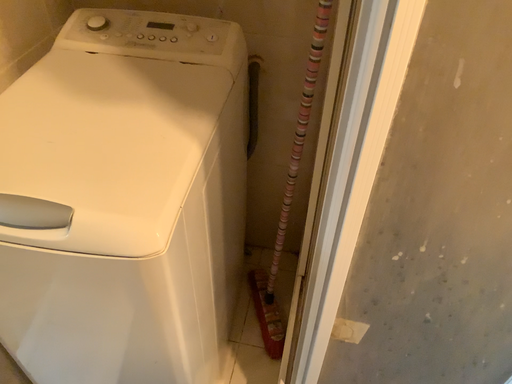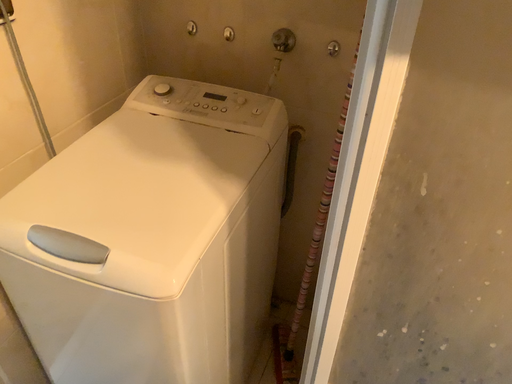
Question: How did the camera likely rotate when shooting the video?

Choices:
 (A) rotated right
 (B) rotated left

Answer: (B)